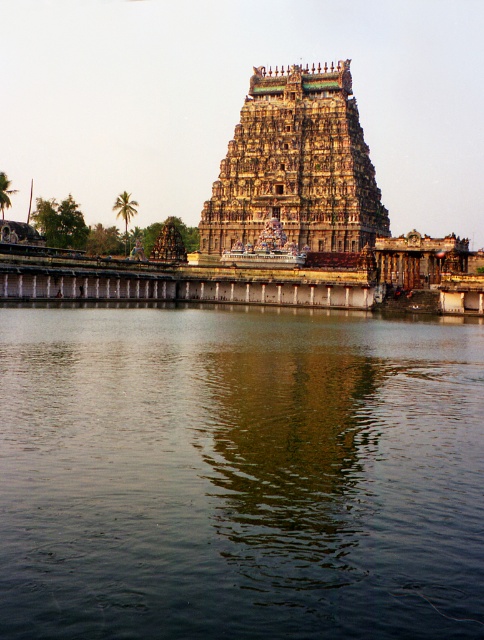
Is green reflective water at center above carved stone temple at center?

No, green reflective water at center is not above carved stone temple at center.

Between green reflective water at center and carved stone temple at center, which one has more height?

carved stone temple at center is taller.

Where is `green reflective water at center`? The width and height of the screenshot is (484, 640). green reflective water at center is located at coordinates (239, 474).